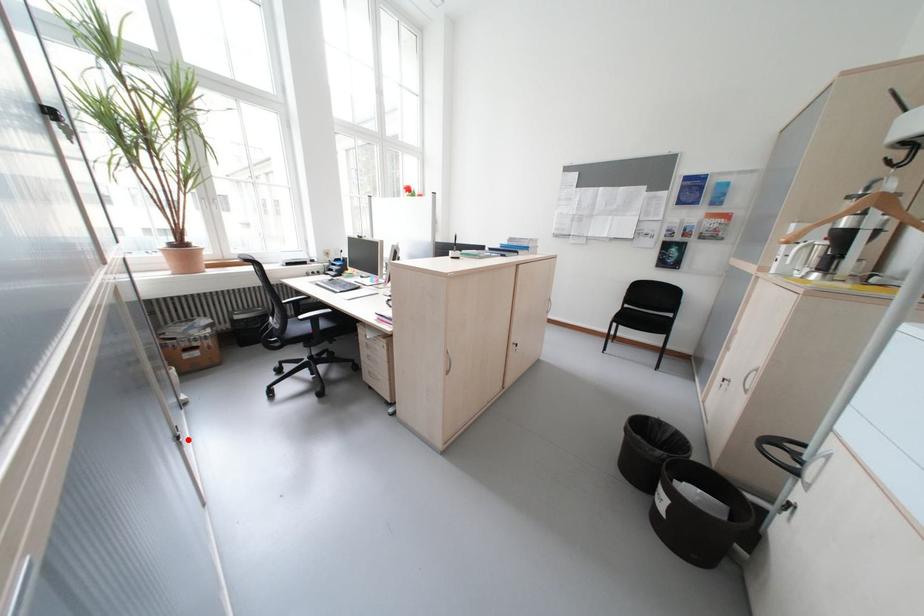
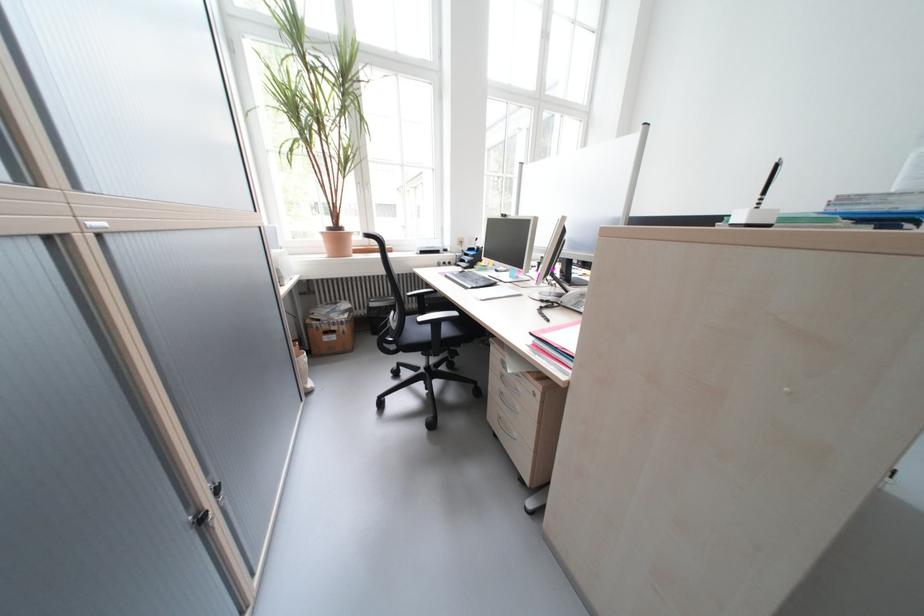
Question: A red point is marked in image1. In image2, is the corresponding 3D point closer to the camera or farther? Reply with the corresponding letter.

Choices:
 (A) The corresponding 3D point is closer.
 (B) The corresponding 3D point is farther.

Answer: (B)